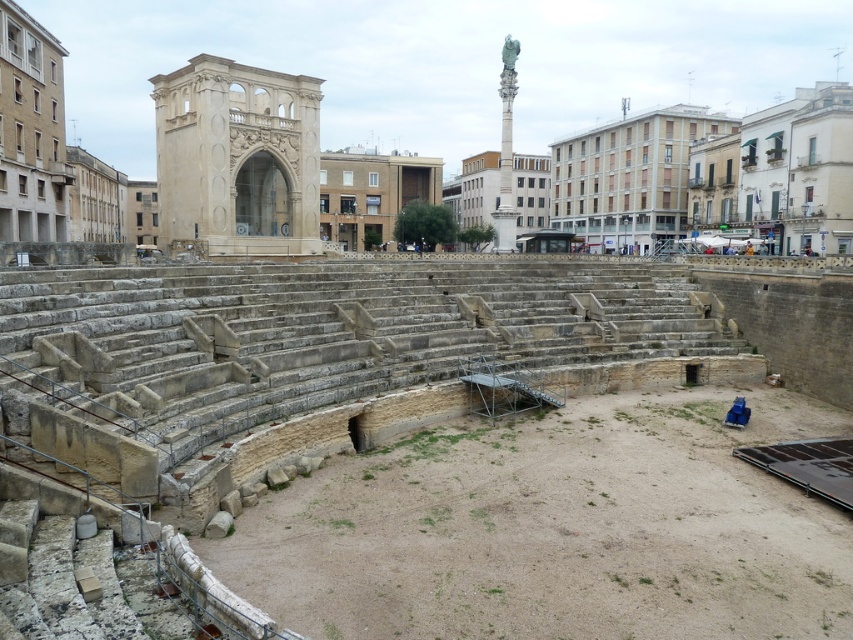
Can you confirm if beige stone arch at center is positioned above green marble column at upper center?

No, beige stone arch at center is not above green marble column at upper center.

Does beige stone arch at center have a larger size compared to green marble column at upper center?

No.

Identify the location of beige stone arch at center. (236, 157).